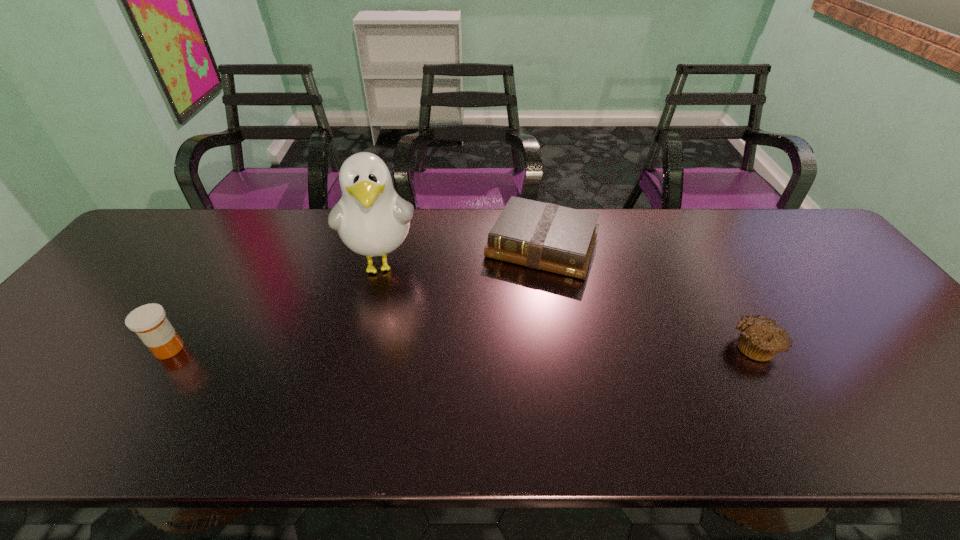
Where is `vacant area that lies between the leftmost object and the rightmost object`? The image size is (960, 540). vacant area that lies between the leftmost object and the rightmost object is located at coordinates (462, 347).

Select which object is the closest to the second object from right to left. Please provide its 2D coordinates. Your answer should be formatted as a tuple, i.e. [(x, y)], where the tuple contains the x and y coordinates of a point satisfying the conditions above.

[(371, 219)]

The height and width of the screenshot is (540, 960). Find the location of `object that stands as the second closest to the leftmost object`. object that stands as the second closest to the leftmost object is located at coordinates (545, 236).

Where is `free space that satisfies the following two spatial constraints: 1. on the front side of the rightmost object; 2. on the right side of the second object from left to right`? The width and height of the screenshot is (960, 540). free space that satisfies the following two spatial constraints: 1. on the front side of the rightmost object; 2. on the right side of the second object from left to right is located at coordinates point(361,346).

I want to click on free space in the image that satisfies the following two spatial constraints: 1. on the front side of the muffin; 2. on the right side of the second object from right to left, so click(x=559, y=346).